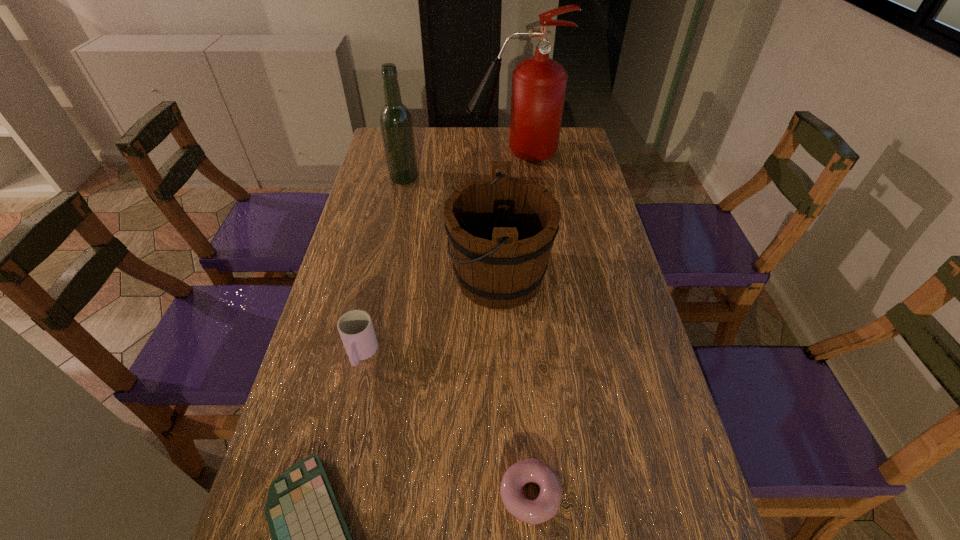
You are a GUI agent. You are given a task and a screenshot of the screen. Output one action in this format:
    pyautogui.click(x=<x>, y=<y>)
    Task: Click on the cup at the left edge
    Image resolution: width=960 pixels, height=540 pixels.
    Given the screenshot: What is the action you would take?
    pyautogui.click(x=355, y=327)

Image resolution: width=960 pixels, height=540 pixels. Find the location of `object positioned at the right edge`. object positioned at the right edge is located at coordinates (539, 84).

Locate an element on the screen. This screenshot has width=960, height=540. object positioned at the far right corner is located at coordinates (539, 84).

Find the location of a particular element. This screenshot has width=960, height=540. free space at the far edge of the desktop is located at coordinates (466, 148).

In the image, there is a desktop. Identify the location of blank space at the left edge. (367, 178).

The image size is (960, 540). In order to click on free space at the right edge of the desktop in this screenshot , I will do `click(639, 355)`.

This screenshot has width=960, height=540. In order to click on free space between the fire extinguisher and the second tallest object in this screenshot , I will do point(459,166).

The height and width of the screenshot is (540, 960). I want to click on free space between the second shortest object and the tallest object, so click(x=521, y=324).

In order to click on free spot between the fire extinguisher and the fifth tallest object in this screenshot , I will do `click(521, 324)`.

At what (x,y) coordinates should I click in order to perform the action: click on vacant space in between the wine bucket and the fifth tallest object. Please return your answer as a coordinate pair (x, y). Looking at the image, I should click on (515, 386).